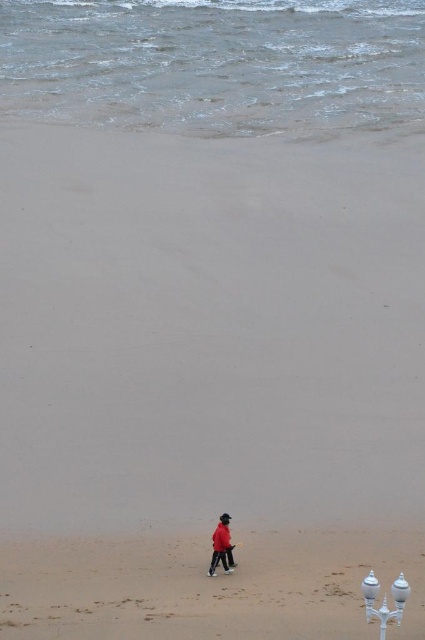
Question: Which point is closer to the camera taking this photo?

Choices:
 (A) (218, 541)
 (B) (235, 580)

Answer: (B)

Question: Can you confirm if sandy beach at lower center is bigger than matte red jacket at lower center?

Choices:
 (A) yes
 (B) no

Answer: (B)

Question: Is the position of sandy beach at lower center more distant than that of matte red jacket at lower center?

Choices:
 (A) no
 (B) yes

Answer: (A)

Question: Can you confirm if sandy beach at lower center is wider than matte red jacket at lower center?

Choices:
 (A) no
 (B) yes

Answer: (A)

Question: Which point appears closest to the camera in this image?

Choices:
 (A) (210, 570)
 (B) (221, 621)

Answer: (B)